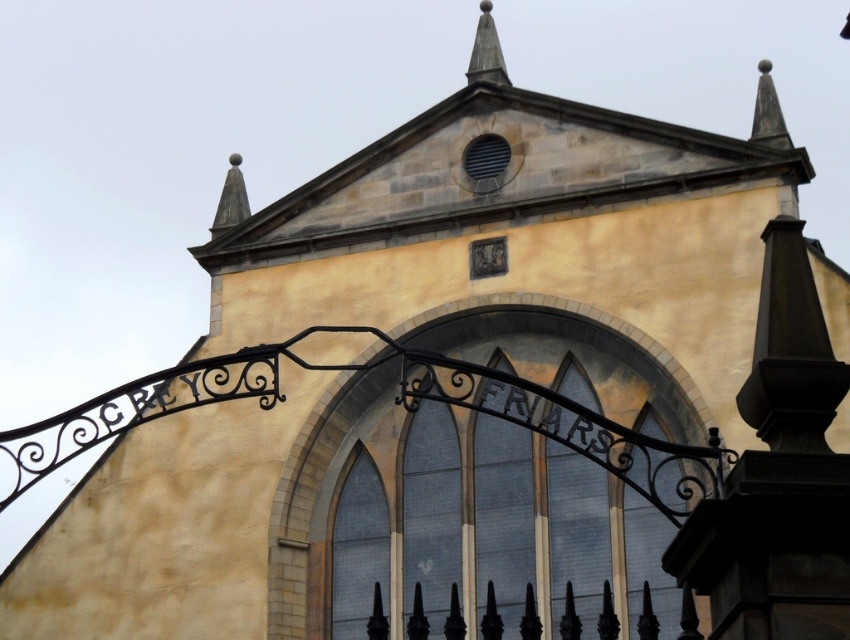
In the scene shown: You are an architect inspecting the building facade. There is a point marked at coordinates (x=486, y=51). What architectural feature is located at this point?

The point at coordinates (x=486, y=51) marks the location of the smooth gray spire at upper center.